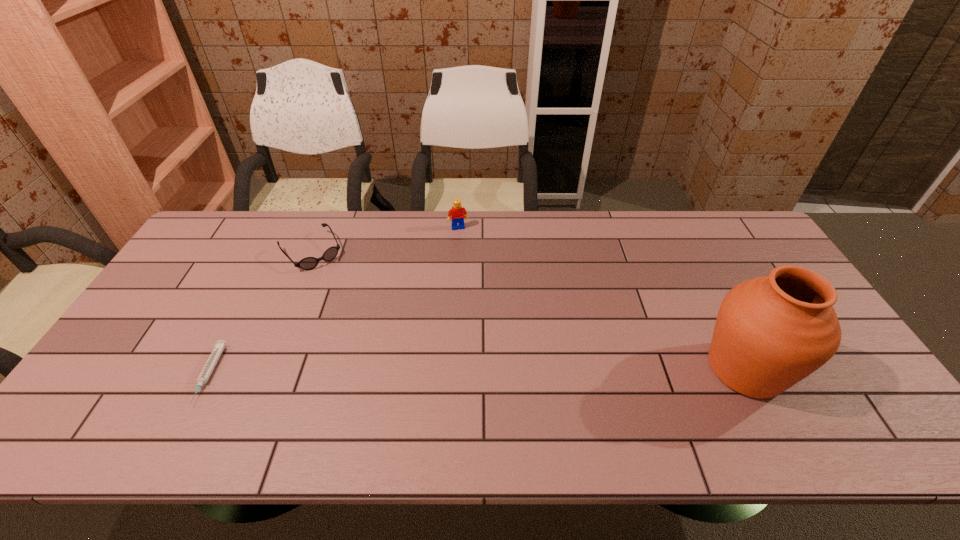
Where is `vacant point located between the third object from left to right and the urn`? vacant point located between the third object from left to right and the urn is located at coordinates (602, 298).

Identify the location of free space that is in between the Lego and the syringe. This screenshot has width=960, height=540. (333, 301).

I want to click on free space between the leftmost object and the second farthest object, so click(260, 313).

Locate an element on the screen. The width and height of the screenshot is (960, 540). vacant point located between the syringe and the second tallest object is located at coordinates (333, 301).

The image size is (960, 540). I want to click on vacant point located between the rightmost object and the sunglasses, so click(528, 310).

You are a GUI agent. You are given a task and a screenshot of the screen. Output one action in this format:
    pyautogui.click(x=<x>, y=<y>)
    Task: Click on the free space between the Lego and the tallest object
    This screenshot has width=960, height=540.
    Given the screenshot: What is the action you would take?
    pyautogui.click(x=602, y=298)

The width and height of the screenshot is (960, 540). Identify the location of object that ranks as the closest to the third object from right to left. (207, 370).

At what (x,y) coordinates should I click in order to perform the action: click on the closest object to the urn. Please return your answer as a coordinate pair (x, y). The width and height of the screenshot is (960, 540). Looking at the image, I should click on (457, 213).